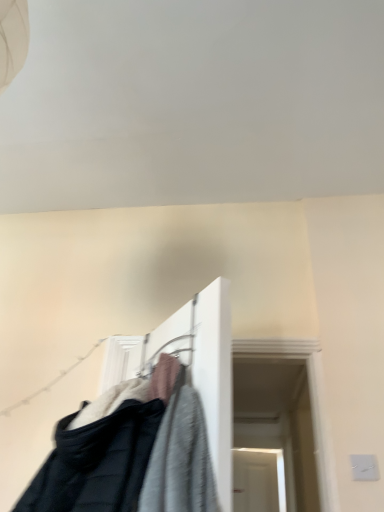
Question: From the image's perspective, relative to textured fabric clothes at center, is black fabric clothesline at lower left above or below?

Choices:
 (A) below
 (B) above

Answer: (A)

Question: Considering their positions, is black fabric clothesline at lower left located in front of or behind textured fabric clothes at center?

Choices:
 (A) behind
 (B) front

Answer: (A)

Question: From a real-world perspective, relative to textured fabric clothes at center, is black fabric clothesline at lower left vertically above or below?

Choices:
 (A) below
 (B) above

Answer: (B)

Question: Is textured fabric clothes at center inside the boundaries of black fabric clothesline at lower left, or outside?

Choices:
 (A) outside
 (B) inside

Answer: (A)

Question: Would you say textured fabric clothes at center is to the left or to the right of black fabric clothesline at lower left in the picture?

Choices:
 (A) left
 (B) right

Answer: (B)

Question: In terms of width, does textured fabric clothes at center look wider or thinner when compared to black fabric clothesline at lower left?

Choices:
 (A) thin
 (B) wide

Answer: (B)

Question: From a real-world perspective, relative to black fabric clothesline at lower left, is textured fabric clothes at center vertically above or below?

Choices:
 (A) above
 (B) below

Answer: (B)